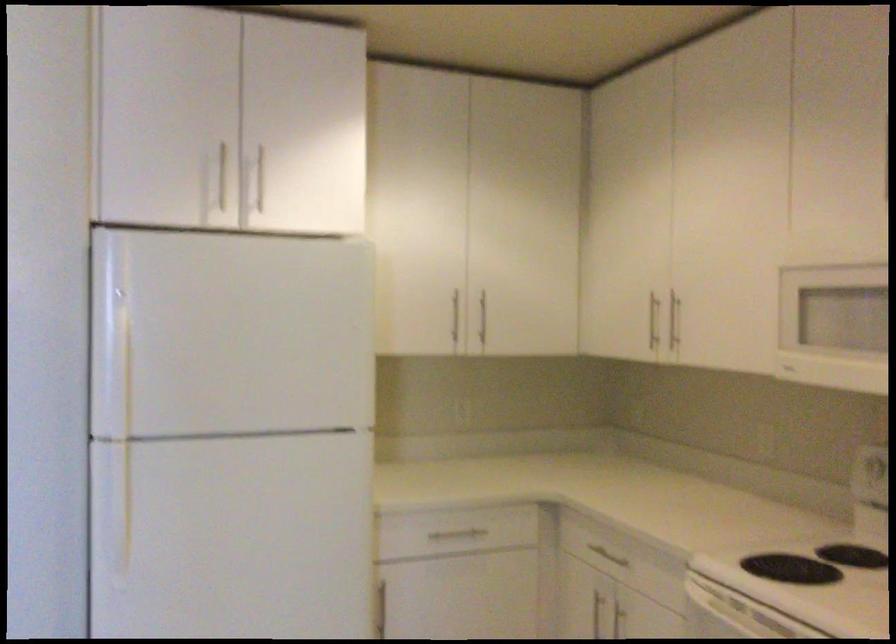
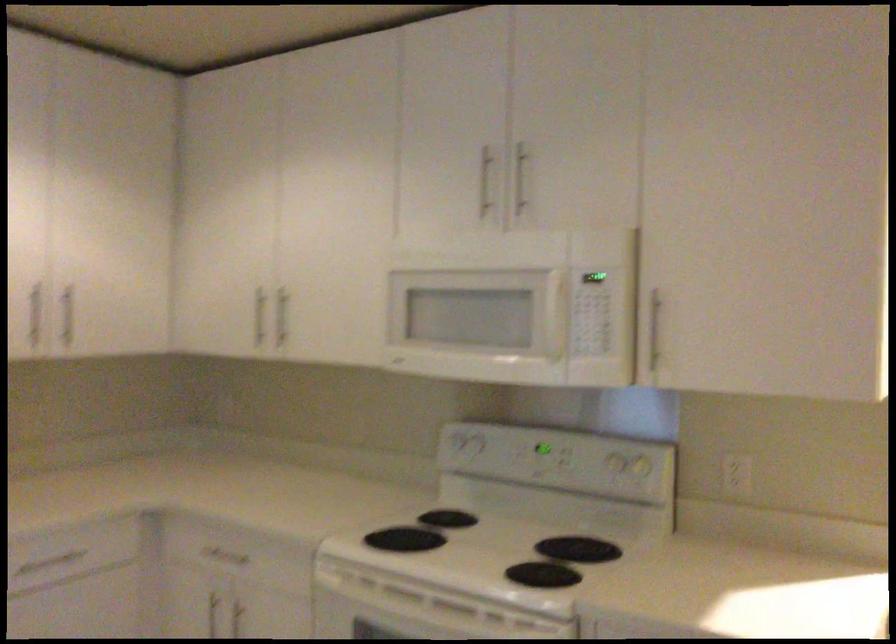
In the second image, find the point that corresponds to [653,319] in the first image.

(259, 316)